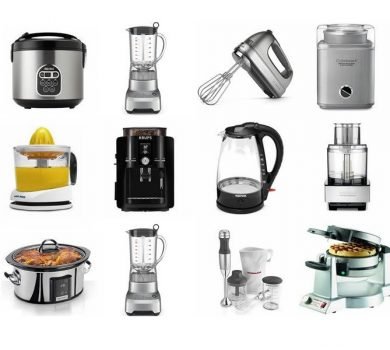
Find the location of a particular element. The height and width of the screenshot is (350, 390). silver pot style cooker is located at coordinates (46, 56).